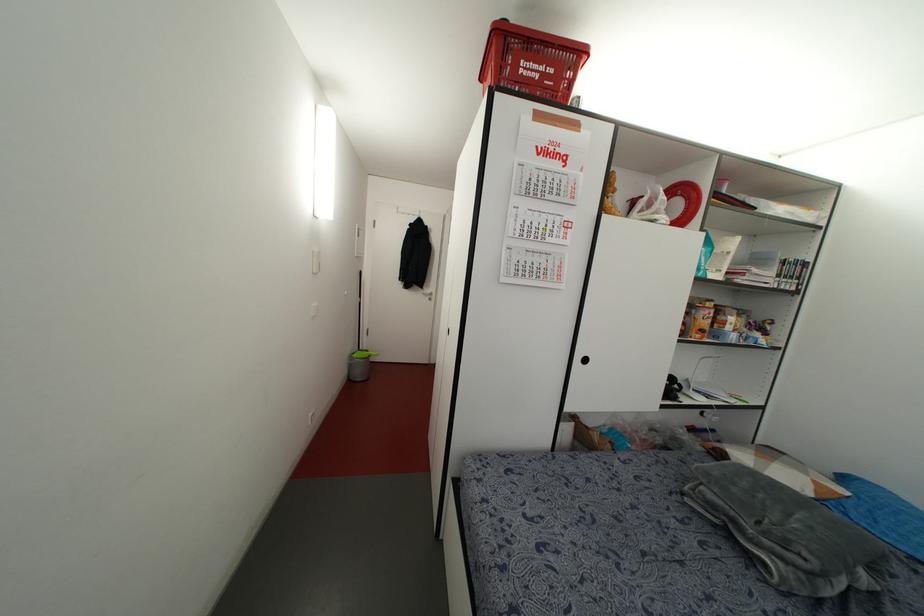
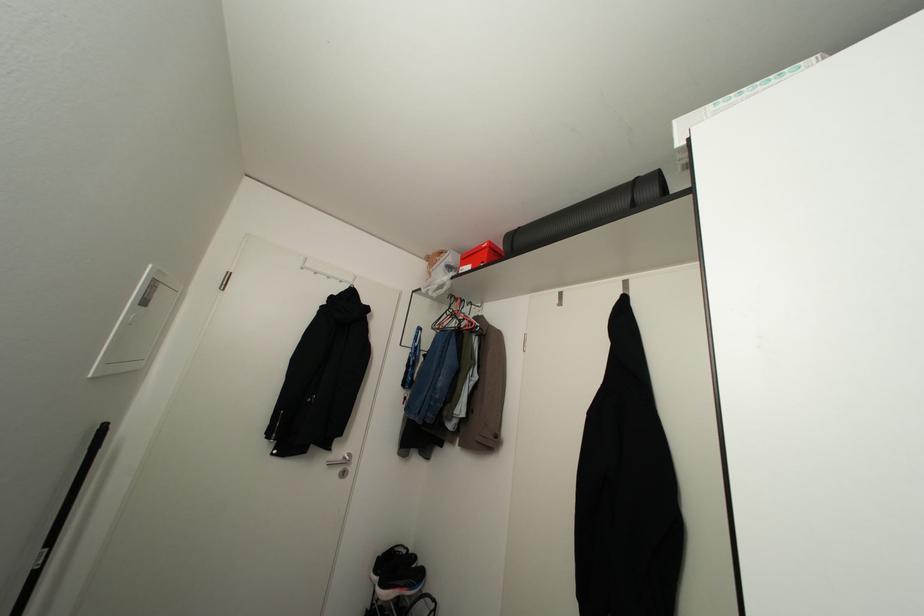
The point at (429, 299) is marked in the first image. Where is the corresponding point in the second image?

(343, 472)